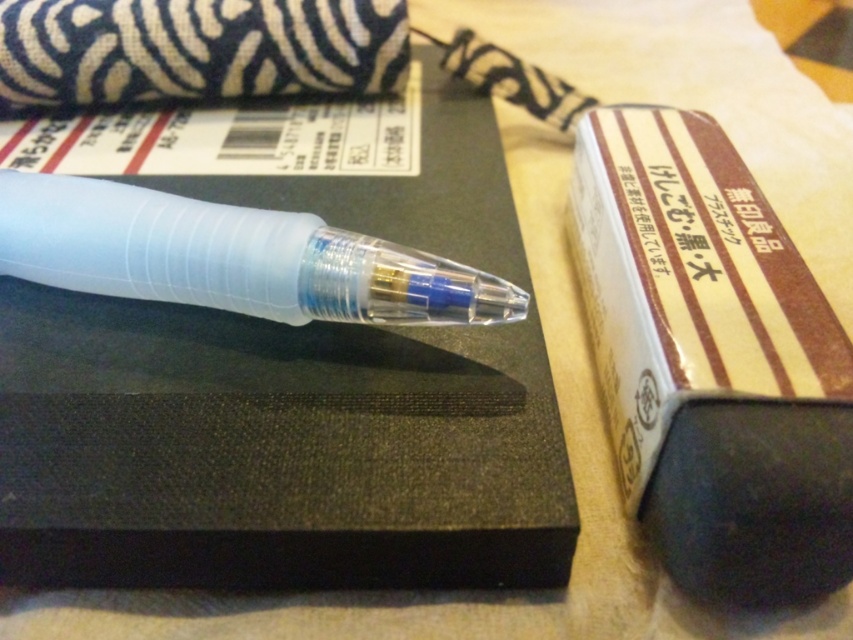
Question: Which of the following is the farthest from the observer?

Choices:
 (A) (520, 241)
 (B) (88, 259)

Answer: (A)

Question: Can you confirm if black matte notebook at center is bigger than translucent plastic pen at center?

Choices:
 (A) yes
 (B) no

Answer: (A)

Question: Which of the following is the closest to the observer?

Choices:
 (A) (488, 244)
 (B) (44, 176)

Answer: (B)

Question: Is black matte notebook at center to the right of translucent plastic pen at center from the viewer's perspective?

Choices:
 (A) no
 (B) yes

Answer: (B)

Question: Considering the relative positions of black matte notebook at center and translucent plastic pen at center in the image provided, where is black matte notebook at center located with respect to translucent plastic pen at center?

Choices:
 (A) right
 (B) left

Answer: (A)